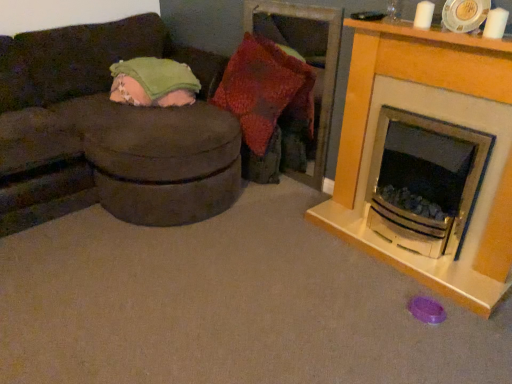
Question: Is knitted fabric pillow at center taller or shorter than white glossy fireplace at right?

Choices:
 (A) short
 (B) tall

Answer: (A)

Question: Would you say knitted fabric pillow at center is to the left or to the right of white glossy fireplace at right in the picture?

Choices:
 (A) right
 (B) left

Answer: (B)

Question: Estimate the real-world distances between objects in this image. Which object is farther from the suede-like brown studio couch at left?

Choices:
 (A) white glossy fireplace at right
 (B) knitted fabric pillow at center
 (C) green soft blanket at upper left

Answer: (A)

Question: Which of these objects is positioned closest to the suede-like brown studio couch at left?

Choices:
 (A) white glossy fireplace at right
 (B) knitted fabric pillow at center
 (C) green soft blanket at upper left

Answer: (C)